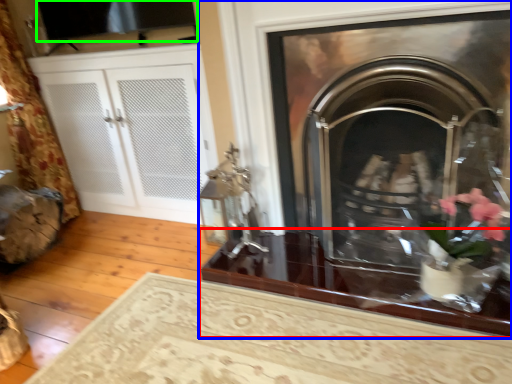
Question: Which is farther away from table (highlighted by a red box)? fireplace (highlighted by a blue box) or window screen (highlighted by a green box)?

Choices:
 (A) fireplace
 (B) window screen

Answer: (B)